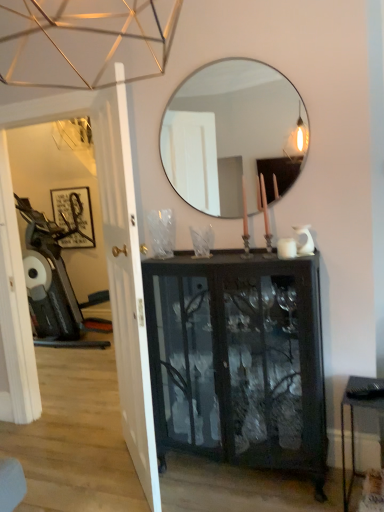
Find the location of a particular element. Image resolution: width=384 pixels, height=512 pixels. vacant area situated below white glossy door at left (from a real-world perspective) is located at coordinates (134, 478).